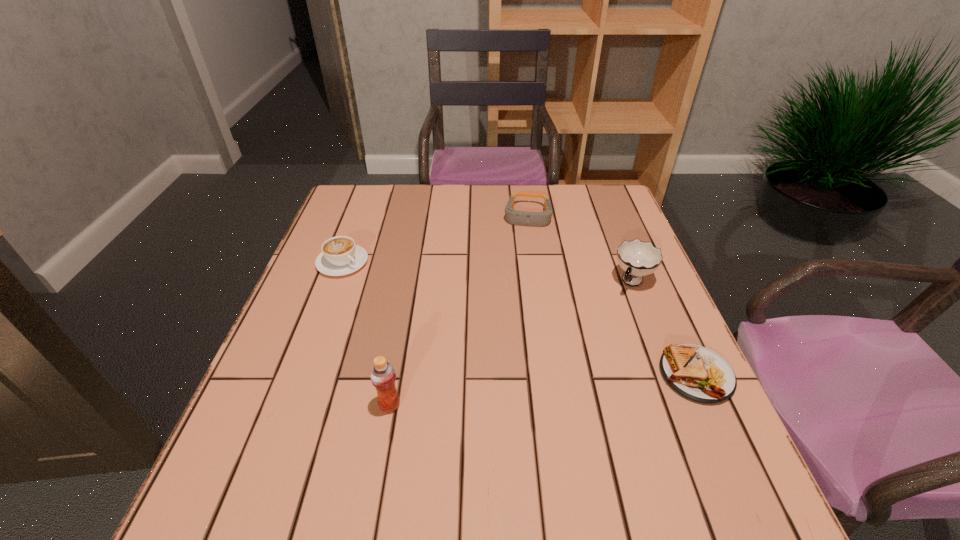
The width and height of the screenshot is (960, 540). Identify the location of vacant space located 0.290m on the side of the leftmost object with the handle. (435, 331).

Where is `vacant position located on the side of the leftmost object with the handle`? The image size is (960, 540). vacant position located on the side of the leftmost object with the handle is located at coordinates (409, 312).

Where is `blank space located 0.060m on the front and back of the second shortest object`? blank space located 0.060m on the front and back of the second shortest object is located at coordinates (525, 244).

The height and width of the screenshot is (540, 960). In order to click on free space located on the front and back of the second shortest object in this screenshot , I will do pyautogui.click(x=525, y=244).

Locate an element on the screen. The width and height of the screenshot is (960, 540). vacant space located 0.100m on the front and back of the second shortest object is located at coordinates (524, 253).

This screenshot has height=540, width=960. I want to click on free space located on the side of the fourth shortest object with the handle, so click(617, 309).

Identify the location of vacant region located on the side of the fourth shortest object with the handle. (615, 312).

Find the location of a particular element. Image resolution: width=960 pixels, height=540 pixels. free space located 0.270m on the side of the fourth shortest object with the handle is located at coordinates [x=579, y=369].

I want to click on object that is at the far edge, so click(520, 218).

Locate an element on the screen. This screenshot has width=960, height=540. object present at the left edge is located at coordinates (340, 256).